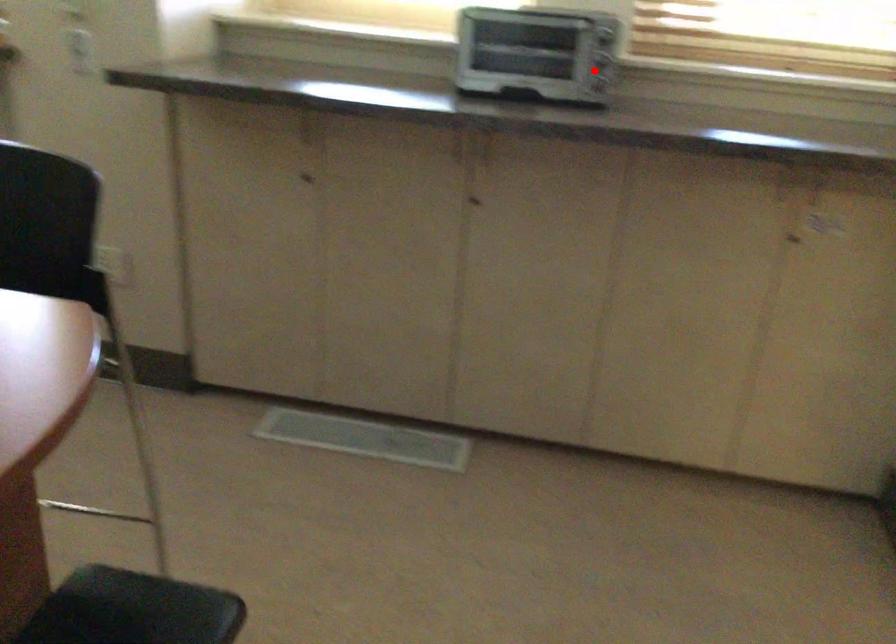
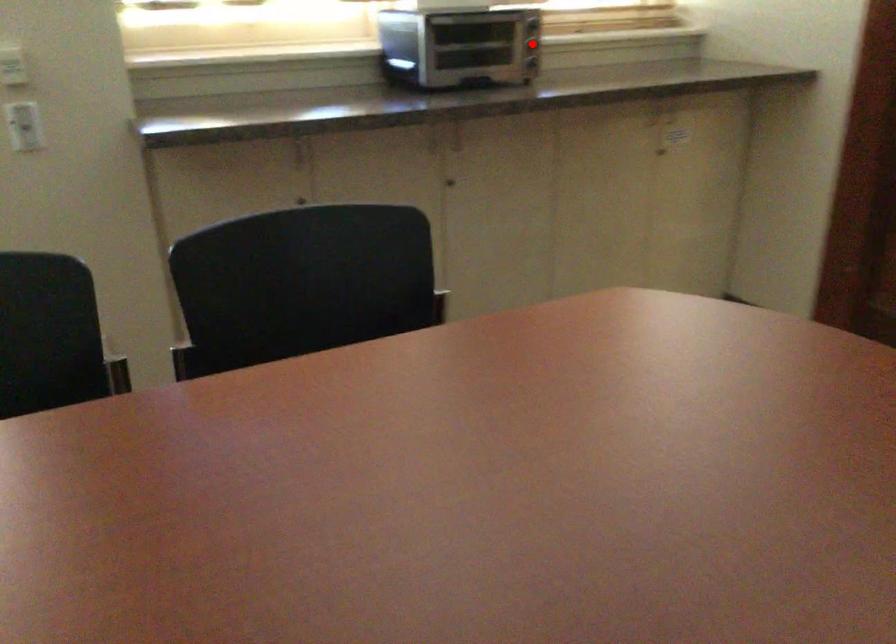
I am providing you with two images of the same scene from different viewpoints. A red point is marked on the first image and another point is marked on the second image. Is the red point in image1 aligned with the point shown in image2?

Yes